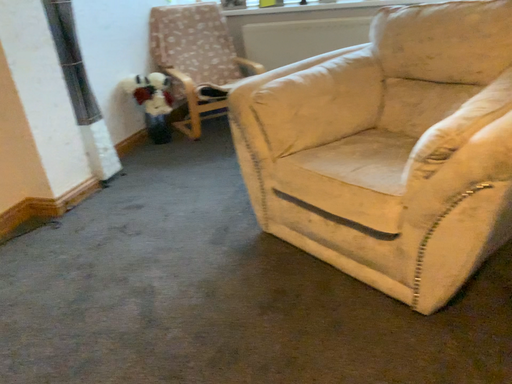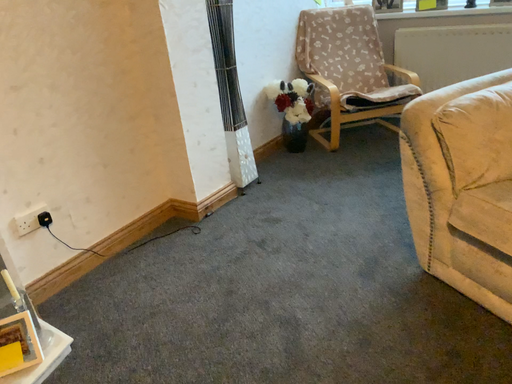
Question: How did the camera likely rotate when shooting the video?

Choices:
 (A) rotated right
 (B) rotated left

Answer: (B)